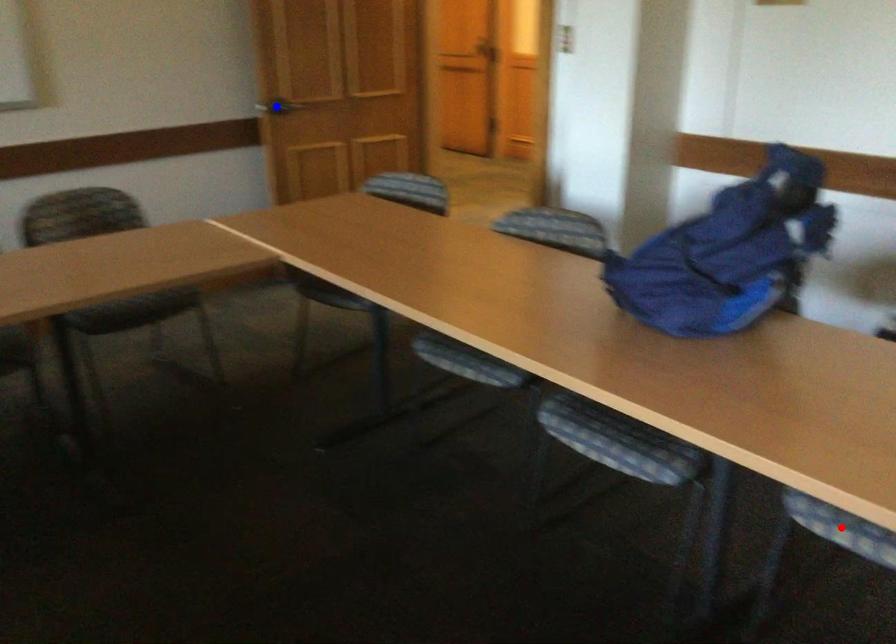
Question: Two points are marked on the image. Which point is closer to the camera?

Choices:
 (A) Blue point is closer.
 (B) Red point is closer.

Answer: (B)